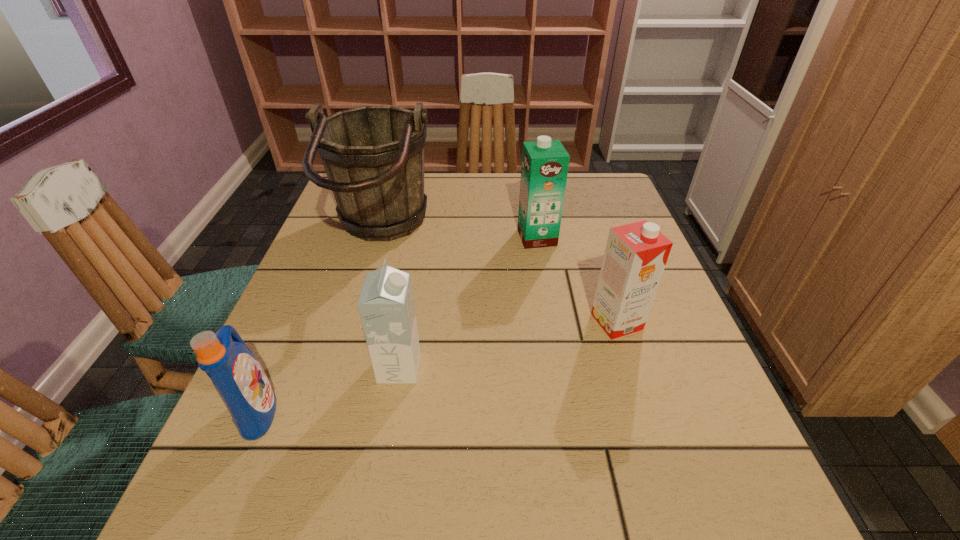
The image size is (960, 540). I want to click on free space located on the front of the third nearest object, so click(x=636, y=383).

You are a GUI agent. You are given a task and a screenshot of the screen. Output one action in this format:
    pyautogui.click(x=<x>, y=<y>)
    Task: Click on the free location located on the label of the detergent
    
    Given the screenshot: What is the action you would take?
    pyautogui.click(x=453, y=410)

This screenshot has height=540, width=960. In order to click on object that is at the far edge in this screenshot , I will do `click(373, 156)`.

The width and height of the screenshot is (960, 540). I want to click on bucket present at the left edge, so click(x=373, y=156).

The height and width of the screenshot is (540, 960). Find the location of `detergent positioned at the left edge`. detergent positioned at the left edge is located at coordinates (238, 377).

Identify the location of object that is at the right edge. (636, 254).

Identify the location of object present at the far left corner. This screenshot has width=960, height=540. (373, 156).

The height and width of the screenshot is (540, 960). Find the location of `free space at the left edge of the desktop`. free space at the left edge of the desktop is located at coordinates (307, 271).

Locate an element on the screen. The height and width of the screenshot is (540, 960). vacant space at the right edge of the desktop is located at coordinates (663, 451).

The height and width of the screenshot is (540, 960). I want to click on vacant space at the far right corner of the desktop, so click(x=586, y=190).